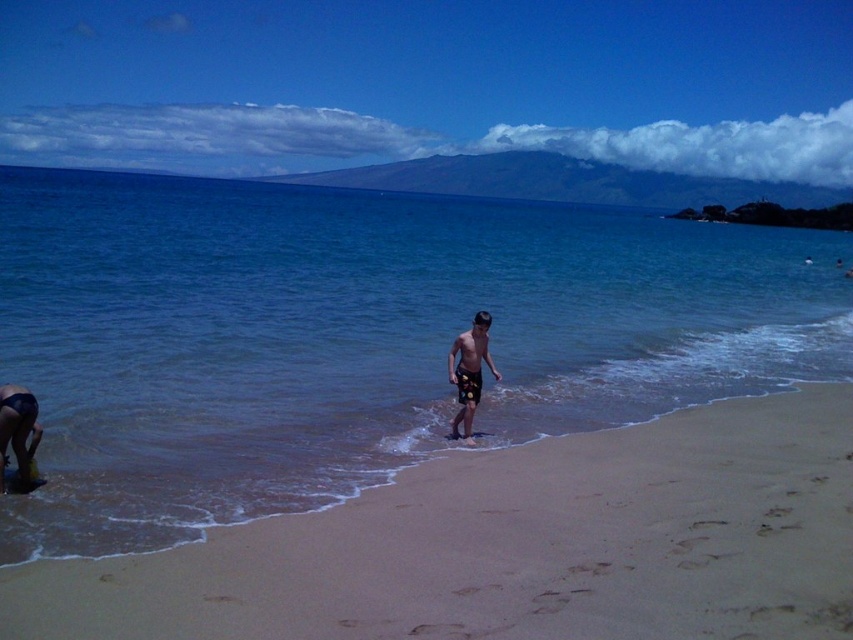
Question: Considering the real-world distances, which object is farthest from the multicolored swim trunks at center?

Choices:
 (A) clear blue water at center
 (B) sandy beach at center

Answer: (A)

Question: Estimate the real-world distances between objects in this image. Which object is farther from the clear blue water at center?

Choices:
 (A) multicolored swim trunks at center
 (B) sandy beach at center

Answer: (A)

Question: Is the position of clear blue water at center more distant than that of sandy beach at center?

Choices:
 (A) yes
 (B) no

Answer: (A)

Question: Where is clear blue water at center located in relation to sandy beach at center in the image?

Choices:
 (A) above
 (B) below

Answer: (A)

Question: Can you confirm if sandy beach at center is wider than multicolored swim trunks at center?

Choices:
 (A) yes
 (B) no

Answer: (A)

Question: Among these points, which one is nearest to the camera?

Choices:
 (A) (463, 353)
 (B) (682, 403)

Answer: (A)